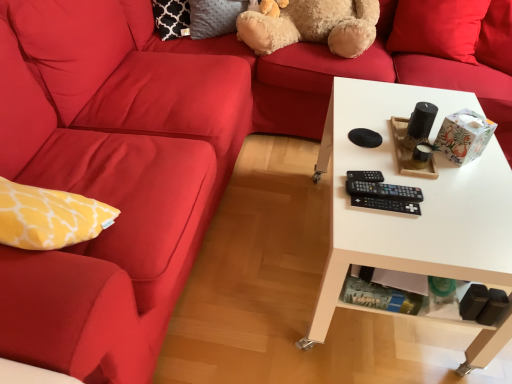
Question: Would you say matte red couch at left is to the left or to the right of fuzzy beige teddy bear at upper center in the picture?

Choices:
 (A) left
 (B) right

Answer: (A)

Question: Considering the positions of matte red couch at left and fuzzy beige teddy bear at upper center in the image, is matte red couch at left bigger or smaller than fuzzy beige teddy bear at upper center?

Choices:
 (A) small
 (B) big

Answer: (B)

Question: Estimate the real-world distances between objects in this image. Which object is farther from the white glossy table at right?

Choices:
 (A) black plastic remote at center, the first control from the back
 (B) black plastic remote at center, which is the second control from front to back
 (C) matte red couch at left
 (D) red matte pillow at upper right
 (E) black plastic remote at center, which appears as the 3th control when viewed from the back

Answer: (D)

Question: Considering the real-world distances, which object is farthest from the black plastic remote at center, which ranks as the 2th control in back-to-front order?

Choices:
 (A) red matte pillow at upper right
 (B) white glossy table at right
 (C) fuzzy beige teddy bear at upper center
 (D) black plastic remote at center, which appears as the 3th control when viewed from the back
 (E) matte red couch at left

Answer: (A)